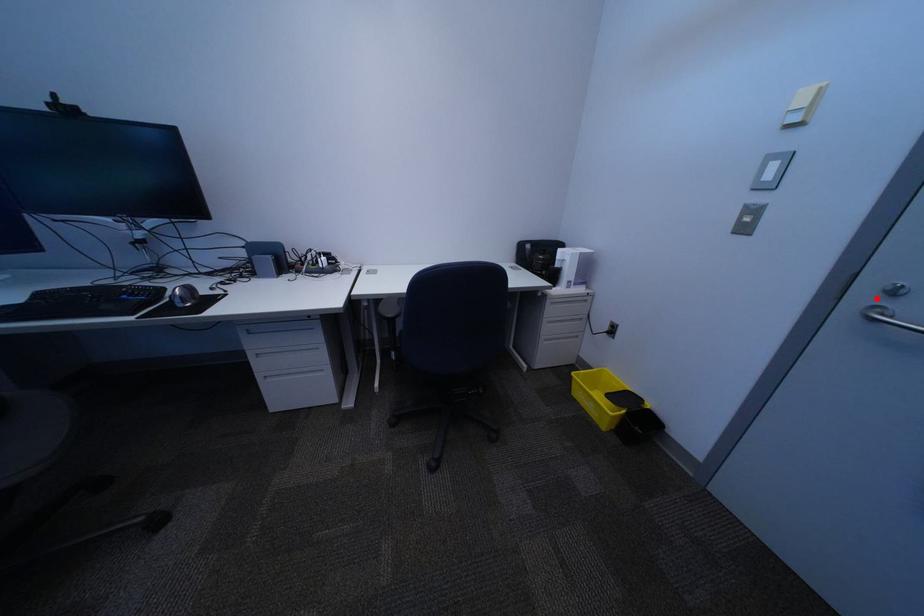
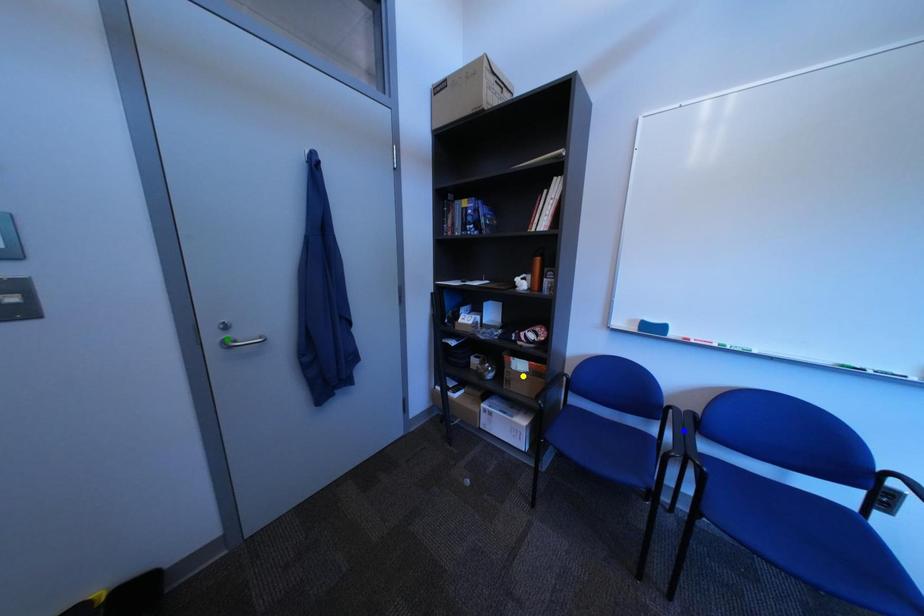
Question: I am providing you with two images of the same scene from different viewpoints. A red point is marked on the first image. You are given multiple points on the second image. Which point in image 2 is actually the same real-world point as the red point in image 1?

Choices:
 (A) green point
 (B) blue point
 (C) yellow point

Answer: (A)